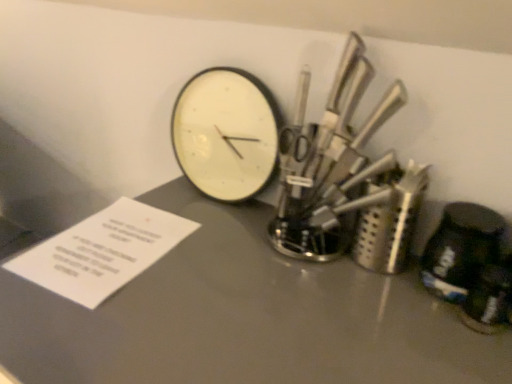
Find the location of a particular element. The width and height of the screenshot is (512, 384). empty space that is in between white matte wall clock at center and white paper at lower left is located at coordinates (201, 240).